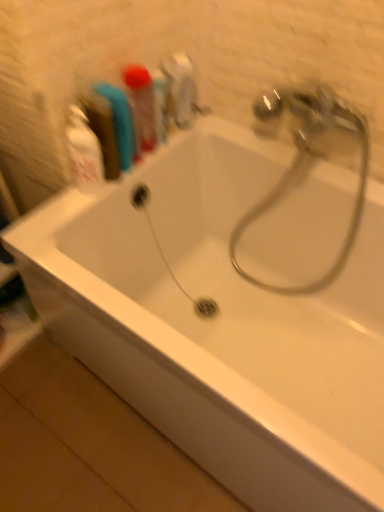
Question: Should I look upward or downward to see blue rubber toothbrush at upper left, which is the first toiletry in left-to-right order?

Choices:
 (A) up
 (B) down

Answer: (A)

Question: Is white glossy bottle at upper left surrounded by blue rubber toothbrush at upper left, which is the first toiletry in left-to-right order?

Choices:
 (A) no
 (B) yes

Answer: (A)

Question: Considering the relative sizes of blue rubber toothbrush at upper left, which is counted as the 2th toiletry, starting from the right, and white glossy bottle at upper left in the image provided, is blue rubber toothbrush at upper left, which is counted as the 2th toiletry, starting from the right, taller than white glossy bottle at upper left?

Choices:
 (A) yes
 (B) no

Answer: (B)

Question: From the image's perspective, is blue rubber toothbrush at upper left, which is the first toiletry in left-to-right order, beneath white glossy bottle at upper left?

Choices:
 (A) yes
 (B) no

Answer: (B)

Question: Can you confirm if blue rubber toothbrush at upper left, which is the first toiletry in left-to-right order, is wider than white glossy bottle at upper left?

Choices:
 (A) yes
 (B) no

Answer: (A)

Question: Considering the relative positions of blue rubber toothbrush at upper left, which is counted as the 2th toiletry, starting from the right, and white glossy bottle at upper left in the image provided, is blue rubber toothbrush at upper left, which is counted as the 2th toiletry, starting from the right, to the right of white glossy bottle at upper left from the viewer's perspective?

Choices:
 (A) yes
 (B) no

Answer: (A)

Question: Is blue rubber toothbrush at upper left, which is the first toiletry in left-to-right order, oriented towards white glossy bottle at upper left?

Choices:
 (A) no
 (B) yes

Answer: (A)

Question: Can you confirm if white glossy bottle at upper left is shorter than translucent plastic toothbrush at upper left, which is the second toiletry in left-to-right order?

Choices:
 (A) yes
 (B) no

Answer: (B)

Question: From a real-world perspective, is white glossy bottle at upper left positioned under translucent plastic toothbrush at upper left, acting as the first toiletry starting from the right, based on gravity?

Choices:
 (A) yes
 (B) no

Answer: (A)

Question: From a real-world perspective, is white glossy bottle at upper left on translucent plastic toothbrush at upper left, which is the second toiletry in left-to-right order?

Choices:
 (A) no
 (B) yes

Answer: (A)

Question: Is white glossy bottle at upper left wider than translucent plastic toothbrush at upper left, acting as the first toiletry starting from the right?

Choices:
 (A) no
 (B) yes

Answer: (A)

Question: From the image's perspective, is white glossy bottle at upper left above translucent plastic toothbrush at upper left, acting as the first toiletry starting from the right?

Choices:
 (A) no
 (B) yes

Answer: (A)

Question: Is white glossy bottle at upper left positioned with its back to translucent plastic toothbrush at upper left, acting as the first toiletry starting from the right?

Choices:
 (A) yes
 (B) no

Answer: (B)

Question: Can you confirm if polished chrome tap at upper right is shorter than translucent plastic toothbrush at upper left, acting as the first toiletry starting from the right?

Choices:
 (A) yes
 (B) no

Answer: (B)